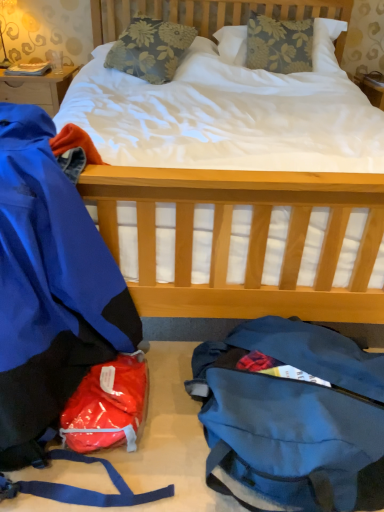
Image resolution: width=384 pixels, height=512 pixels. What do you see at coordinates (150, 48) in the screenshot? I see `floral fabric pillow at center, positioned as the second pillow in right-to-left order` at bounding box center [150, 48].

What do you see at coordinates (107, 405) in the screenshot? The height and width of the screenshot is (512, 384). I see `shiny plastic bag at lower left` at bounding box center [107, 405].

Describe the element at coordinates (4, 53) in the screenshot. I see `matte gold lamp at upper left` at that location.

Describe the element at coordinates (49, 288) in the screenshot. The width and height of the screenshot is (384, 512). I see `blue waterproof jacket at left` at that location.

The image size is (384, 512). Identify the location of floral fabric pillow at center, positioned as the second pillow in right-to-left order. (150, 48).

Which is behind, floral fabric pillow at upper center, which is the second pillow in left-to-right order, or floral fabric pillow at center, the 1th pillow when ordered from left to right?

floral fabric pillow at upper center, which is the second pillow in left-to-right order, is further from the camera.

Considering the positions of objects floral fabric pillow at upper center, which is the second pillow in left-to-right order, and floral fabric pillow at center, the 1th pillow when ordered from left to right, in the image provided, who is more to the right, floral fabric pillow at upper center, which is the second pillow in left-to-right order, or floral fabric pillow at center, the 1th pillow when ordered from left to right,?

From the viewer's perspective, floral fabric pillow at upper center, which is the second pillow in left-to-right order, appears more on the right side.

Where is `pillow to the left of floral fabric pillow at upper center, which is the second pillow in left-to-right order`? pillow to the left of floral fabric pillow at upper center, which is the second pillow in left-to-right order is located at coordinates (150, 48).

How distant is hardcover book at upper left from floral fabric pillow at center, positioned as the second pillow in right-to-left order?

A distance of 31.17 inches exists between hardcover book at upper left and floral fabric pillow at center, positioned as the second pillow in right-to-left order.

Is hardcover book at upper left to the right of floral fabric pillow at center, the 1th pillow when ordered from left to right, from the viewer's perspective?

Incorrect, hardcover book at upper left is not on the right side of floral fabric pillow at center, the 1th pillow when ordered from left to right.

From the picture: Which object is more forward, hardcover book at upper left or floral fabric pillow at center, the 1th pillow when ordered from left to right?

Positioned in front is floral fabric pillow at center, the 1th pillow when ordered from left to right.

Are hardcover book at upper left and floral fabric pillow at center, positioned as the second pillow in right-to-left order, far apart?

No, there isn't a large distance between hardcover book at upper left and floral fabric pillow at center, positioned as the second pillow in right-to-left order.

How different are the orientations of hardcover book at upper left and matte gold lamp at upper left in degrees?

They differ by 2.04 degrees in their facing directions.

Between point (16, 64) and point (6, 65), which one is positioned in front?

The point (6, 65) is more forward.

Is hardcover book at upper left further to camera compared to matte gold lamp at upper left?

Yes.

From the image's perspective, is hardcover book at upper left above matte gold lamp at upper left?

Actually, hardcover book at upper left appears below matte gold lamp at upper left in the image.

Is shiny plastic bag at lower left smaller than wooden desk at upper left?

Correct, shiny plastic bag at lower left occupies less space than wooden desk at upper left.

In the scene shown: From the image's perspective, would you say shiny plastic bag at lower left is shown under wooden desk at upper left?

Yes, from the image's perspective, shiny plastic bag at lower left is below wooden desk at upper left.

Which is behind, point (129, 411) or point (15, 84)?

The point (15, 84) is behind.

Which object is thinner, shiny plastic bag at lower left or wooden desk at upper left?

With smaller width is shiny plastic bag at lower left.

Does blue waterproof jacket at left contain matte gold lamp at upper left?

No, matte gold lamp at upper left is not surrounded by blue waterproof jacket at left.

At what (x,y) coordinates should I click in order to perform the action: click on lamp behind the blue waterproof jacket at left. Please return your answer as a coordinate pair (x, y). Looking at the image, I should click on (4, 53).

Is point (41, 304) farther from camera compared to point (6, 59)?

No.

Considering the positions of objects blue waterproof jacket at left and matte gold lamp at upper left in the image provided, who is behind, blue waterproof jacket at left or matte gold lamp at upper left?

matte gold lamp at upper left is further from the camera.

Is hardcover book at upper left inside or outside of shiny plastic bag at lower left?

hardcover book at upper left is outside shiny plastic bag at lower left.

From the picture: Considering the sizes of objects hardcover book at upper left and shiny plastic bag at lower left in the image provided, who is smaller, hardcover book at upper left or shiny plastic bag at lower left?

hardcover book at upper left.

Considering the positions of objects hardcover book at upper left and shiny plastic bag at lower left in the image provided, who is more to the right, hardcover book at upper left or shiny plastic bag at lower left?

shiny plastic bag at lower left is more to the right.

Considering the relative positions of hardcover book at upper left and shiny plastic bag at lower left in the image provided, is hardcover book at upper left behind shiny plastic bag at lower left?

Yes, hardcover book at upper left is further from the viewer.

Does matte gold lamp at upper left have a lesser height compared to floral fabric pillow at upper center, the first pillow positioned from the right?

Indeed, matte gold lamp at upper left has a lesser height compared to floral fabric pillow at upper center, the first pillow positioned from the right.

Considering the relative positions of matte gold lamp at upper left and floral fabric pillow at upper center, the first pillow positioned from the right, in the image provided, is matte gold lamp at upper left to the right of floral fabric pillow at upper center, the first pillow positioned from the right, from the viewer's perspective?

In fact, matte gold lamp at upper left is to the left of floral fabric pillow at upper center, the first pillow positioned from the right.

Is matte gold lamp at upper left positioned far away from floral fabric pillow at upper center, which is the second pillow in left-to-right order?

Yes, matte gold lamp at upper left and floral fabric pillow at upper center, which is the second pillow in left-to-right order, are located far from each other.

Can you tell me how much matte gold lamp at upper left and floral fabric pillow at upper center, which is the second pillow in left-to-right order, differ in facing direction?

matte gold lamp at upper left and floral fabric pillow at upper center, which is the second pillow in left-to-right order, are facing 10 degrees away from each other.

Identify the location of pillow that is below the floral fabric pillow at upper center, the first pillow positioned from the right (from the image's perspective). (150, 48).

At what (x,y) coordinates should I click in order to perform the action: click on the 1st pillow located above the hardcover book at upper left (from a real-world perspective). Please return your answer as a coordinate pair (x, y). Looking at the image, I should click on (150, 48).

From the image, which object appears to be farther from floral fabric pillow at upper center, which is the second pillow in left-to-right order, shiny plastic bag at lower left or floral fabric pillow at center, the 1th pillow when ordered from left to right?

The object further to floral fabric pillow at upper center, which is the second pillow in left-to-right order, is shiny plastic bag at lower left.

From the image, which object appears to be nearer to hardcover book at upper left, shiny plastic bag at lower left or floral fabric pillow at center, the 1th pillow when ordered from left to right?

Among the two, floral fabric pillow at center, the 1th pillow when ordered from left to right, is located nearer to hardcover book at upper left.

Looking at the image, which one is located further to floral fabric pillow at center, the 1th pillow when ordered from left to right, blue waterproof jacket at left or matte gold lamp at upper left?

Among the two, blue waterproof jacket at left is located further to floral fabric pillow at center, the 1th pillow when ordered from left to right.

Looking at the image, which one is located closer to floral fabric pillow at upper center, which is the second pillow in left-to-right order, wooden desk at upper left or blue waterproof jacket at left?

wooden desk at upper left is closer to floral fabric pillow at upper center, which is the second pillow in left-to-right order.

From the image, which object appears to be nearer to blue waterproof jacket at left, floral fabric pillow at upper center, the first pillow positioned from the right, or floral fabric pillow at center, the 1th pillow when ordered from left to right?

floral fabric pillow at center, the 1th pillow when ordered from left to right, lies closer to blue waterproof jacket at left than the other object.

Looking at the image, which one is located further to floral fabric pillow at center, positioned as the second pillow in right-to-left order, matte gold lamp at upper left or hardcover book at upper left?

matte gold lamp at upper left lies further to floral fabric pillow at center, positioned as the second pillow in right-to-left order, than the other object.

Estimate the real-world distances between objects in this image. Which object is further from floral fabric pillow at center, positioned as the second pillow in right-to-left order, matte gold lamp at upper left or blue waterproof jacket at left?

blue waterproof jacket at left lies further to floral fabric pillow at center, positioned as the second pillow in right-to-left order, than the other object.

Based on their spatial positions, is floral fabric pillow at center, the 1th pillow when ordered from left to right, or floral fabric pillow at upper center, the first pillow positioned from the right, closer to blue waterproof jacket at left?

floral fabric pillow at center, the 1th pillow when ordered from left to right, is closer to blue waterproof jacket at left.

At what (x,y) coordinates should I click in order to perform the action: click on lamp between blue waterproof jacket at left and wooden desk at upper left in the front-back direction. Please return your answer as a coordinate pair (x, y). Looking at the image, I should click on (4, 53).

At what (x,y) coordinates should I click in order to perform the action: click on diaper bag positioned between blue waterproof jacket at left and hardcover book at upper left from near to far. Please return your answer as a coordinate pair (x, y). Looking at the image, I should click on (107, 405).

Where is `book between matte gold lamp at upper left and floral fabric pillow at center, positioned as the second pillow in right-to-left order, from left to right`? This screenshot has width=384, height=512. book between matte gold lamp at upper left and floral fabric pillow at center, positioned as the second pillow in right-to-left order, from left to right is located at coordinates (29, 69).

What are the coordinates of `book between wooden desk at upper left and floral fabric pillow at center, the 1th pillow when ordered from left to right, from left to right` in the screenshot? It's located at tap(29, 69).